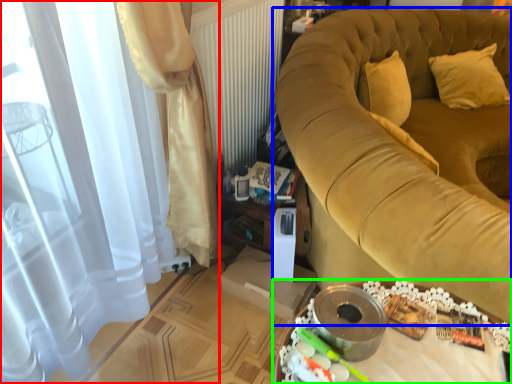
Question: Which object is positioned farthest from curtain (highlighted by a red box)? Select from furniture (highlighted by a blue box) and table (highlighted by a green box).

Choices:
 (A) furniture
 (B) table

Answer: (A)